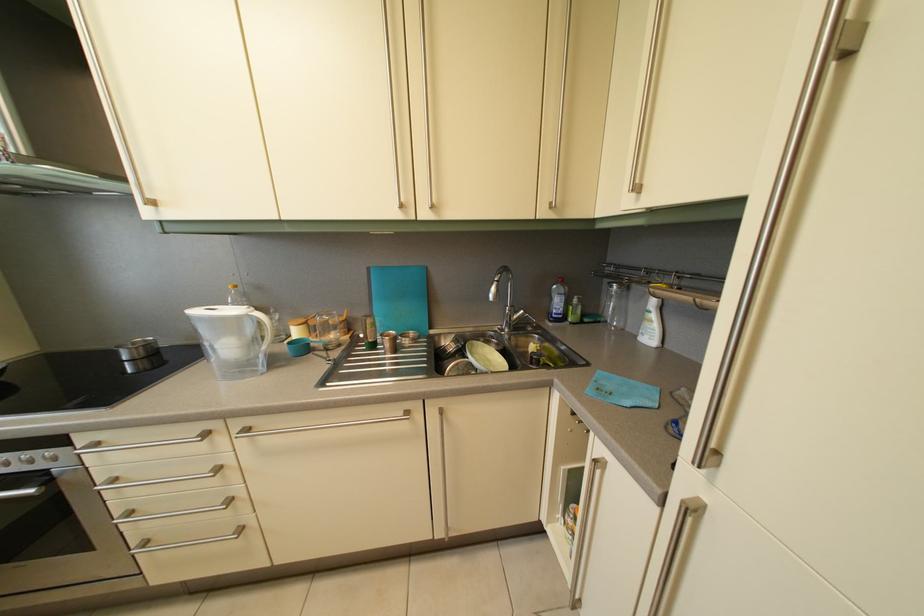
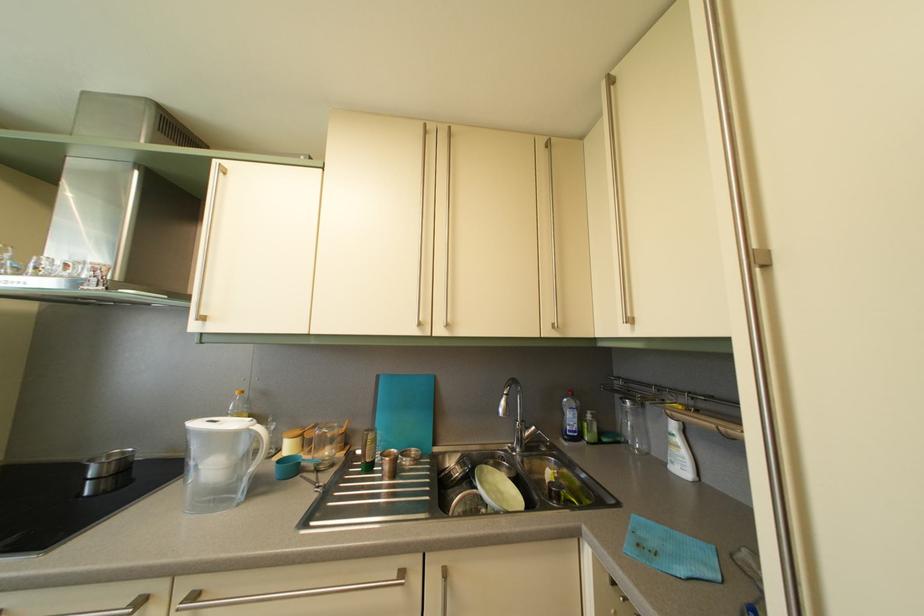
In the second image, find the point that corresponds to (x=254, y=438) in the first image.

(202, 604)